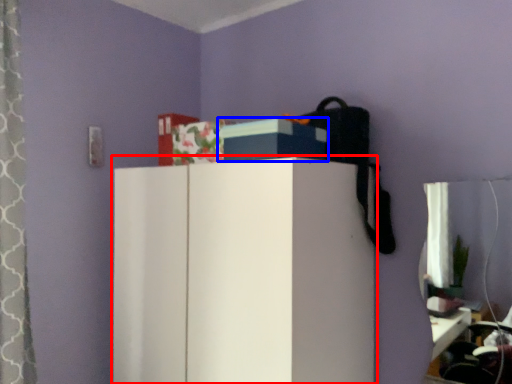
Question: Which point is closer to the camera, furniture (highlighted by a red box) or storage box (highlighted by a blue box)?

Choices:
 (A) furniture
 (B) storage box

Answer: (A)